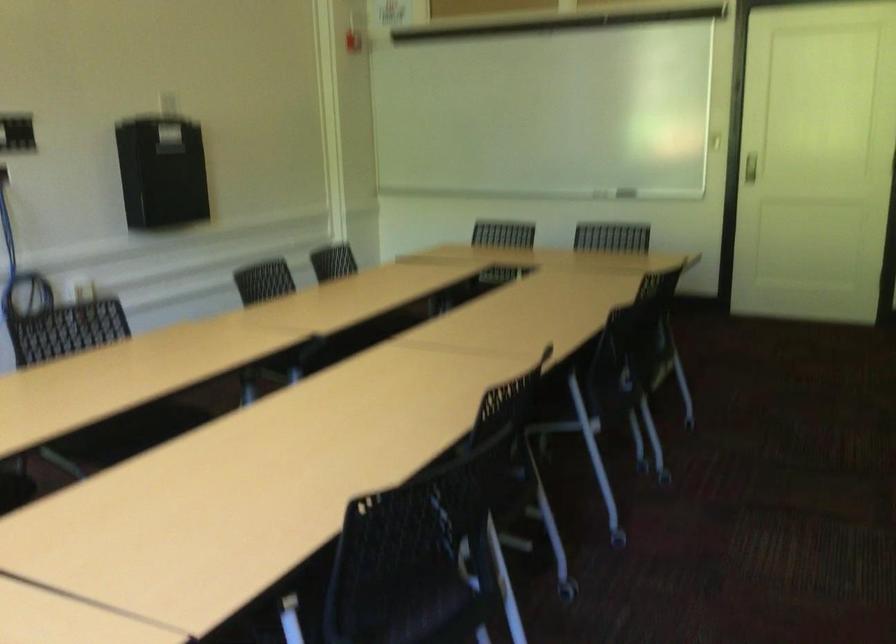
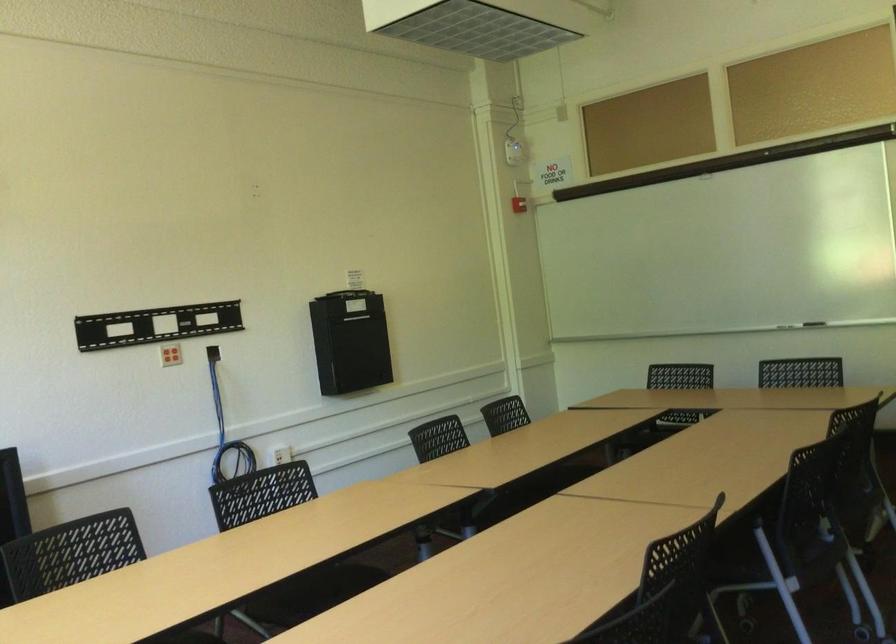
The point at (122, 426) is marked in the first image. Where is the corresponding point in the second image?

(313, 592)